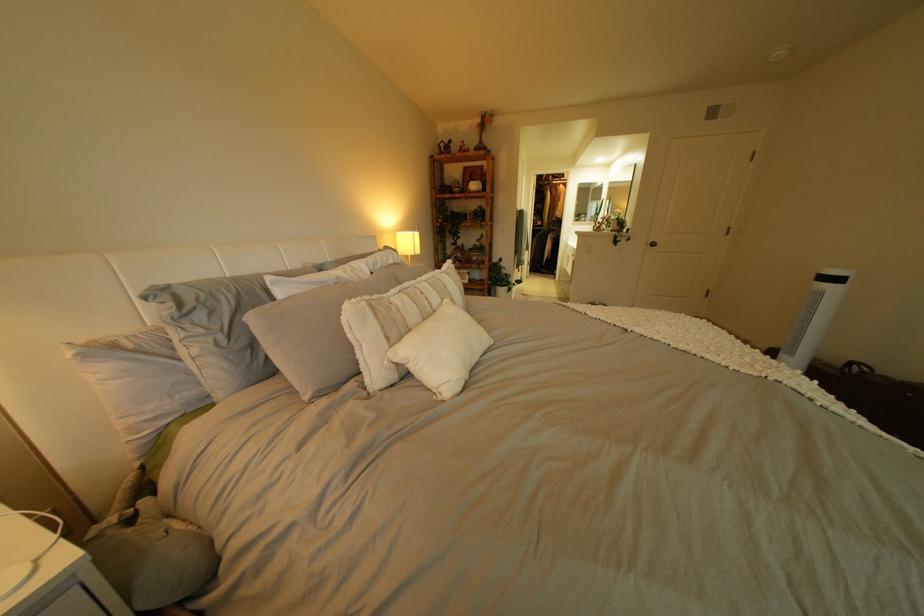
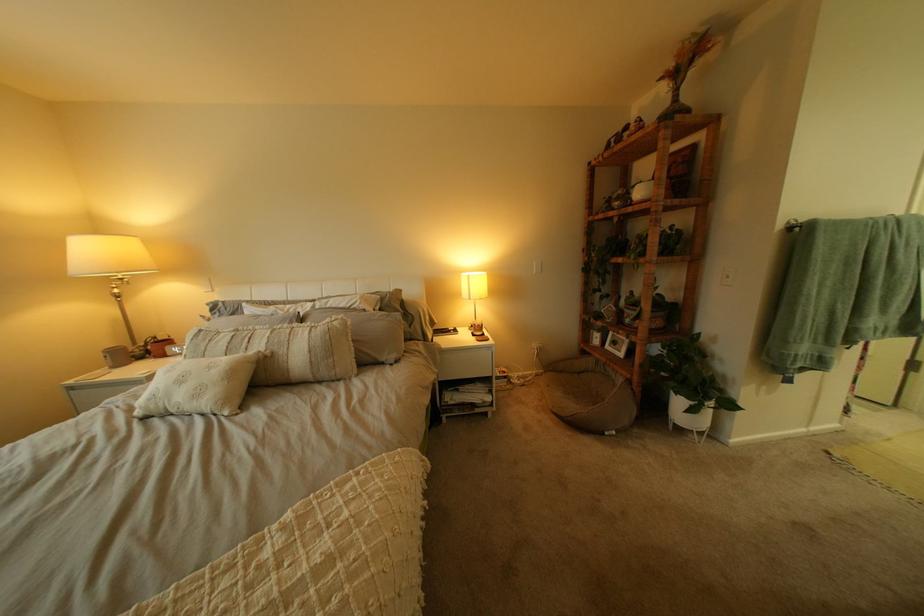
Locate, in the second image, the point that corresponds to the point at 430,235 in the first image.

(483, 277)